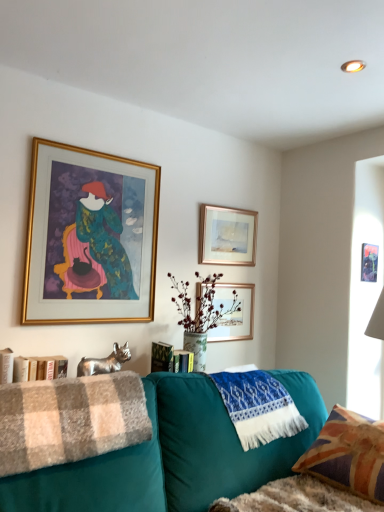
Question: Would you say union jack fabric pillow at lower right is to the left or to the right of gold-framed artwork at upper left, the 1th picture frame when ordered from left to right, in the picture?

Choices:
 (A) right
 (B) left

Answer: (A)

Question: From a real-world perspective, is union jack fabric pillow at lower right physically located above or below gold-framed artwork at upper left, placed as the 4th picture frame when sorted from right to left?

Choices:
 (A) above
 (B) below

Answer: (B)

Question: Which object is the closest to the gold-framed picture at upper center, which is counted as the third picture frame, starting from the left?

Choices:
 (A) plush beige checkered blanket at lower left
 (B) teal fabric couch at lower right
 (C) metallic gold picture frame at upper center, the first picture frame viewed from the right
 (D) gold-framed artwork at upper left, placed as the 4th picture frame when sorted from right to left
 (E) union jack fabric pillow at lower right

Answer: (D)

Question: Which object is positioned closest to the gold-framed picture at upper center, which ranks as the 2th picture frame in left-to-right order?

Choices:
 (A) plush beige checkered blanket at lower left
 (B) gold-framed artwork at upper left, placed as the 4th picture frame when sorted from right to left
 (C) blue knitted blanket at lower center
 (D) teal fabric couch at lower right
 (E) metallic gold picture frame at upper center, the first picture frame viewed from the right

Answer: (C)